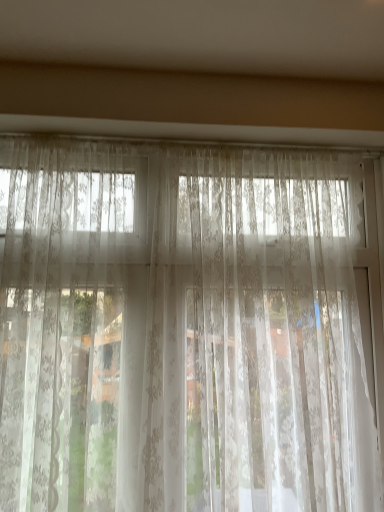
Describe the element at coordinates (183, 330) in the screenshot. The width and height of the screenshot is (384, 512). I see `translucent floral-patterned curtain at center` at that location.

Where is `translucent floral-patterned curtain at center`? The width and height of the screenshot is (384, 512). translucent floral-patterned curtain at center is located at coordinates (183, 330).

Measure the distance between translucent floral-patterned curtain at center and camera.

translucent floral-patterned curtain at center is 4.09 feet away from camera.

Where is `translucent floral-patterned curtain at center`? Image resolution: width=384 pixels, height=512 pixels. translucent floral-patterned curtain at center is located at coordinates (183, 330).